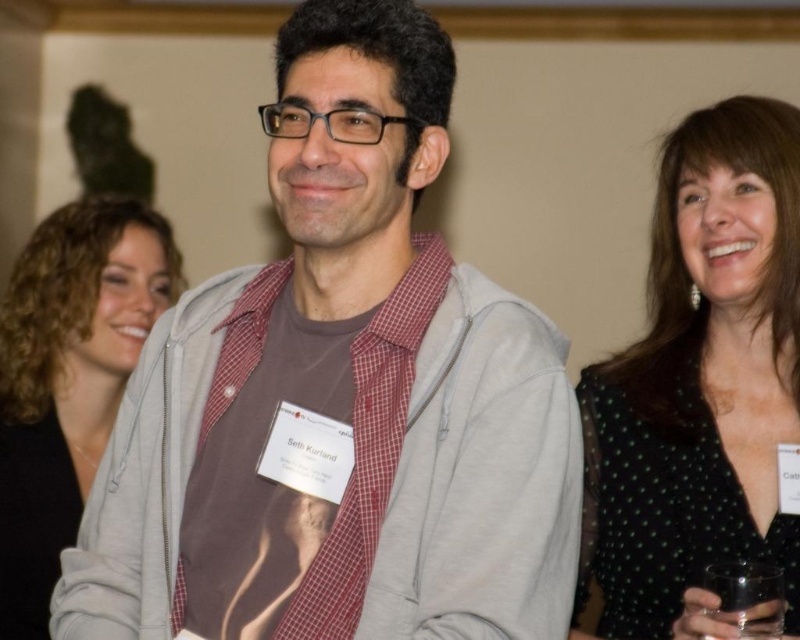
Does black dotted dress at upper right have a greater height compared to transparent glass at lower right?

Indeed, black dotted dress at upper right has a greater height compared to transparent glass at lower right.

The height and width of the screenshot is (640, 800). I want to click on black dotted dress at upper right, so 700,381.

Where is `black dotted dress at upper right`? This screenshot has height=640, width=800. black dotted dress at upper right is located at coordinates (700, 381).

Does gray cotton hoodie at center appear over black matte hair at upper left?

Yes.

Who is positioned more to the right, gray cotton hoodie at center or black matte hair at upper left?

From the viewer's perspective, gray cotton hoodie at center appears more on the right side.

Where is `gray cotton hoodie at center`? This screenshot has width=800, height=640. gray cotton hoodie at center is located at coordinates (341, 396).

Is black matte hair at upper left in front of transparent glass at lower right?

That is False.

Who is positioned more to the right, black matte hair at upper left or transparent glass at lower right?

Positioned to the right is transparent glass at lower right.

This screenshot has height=640, width=800. I want to click on black matte hair at upper left, so click(68, 378).